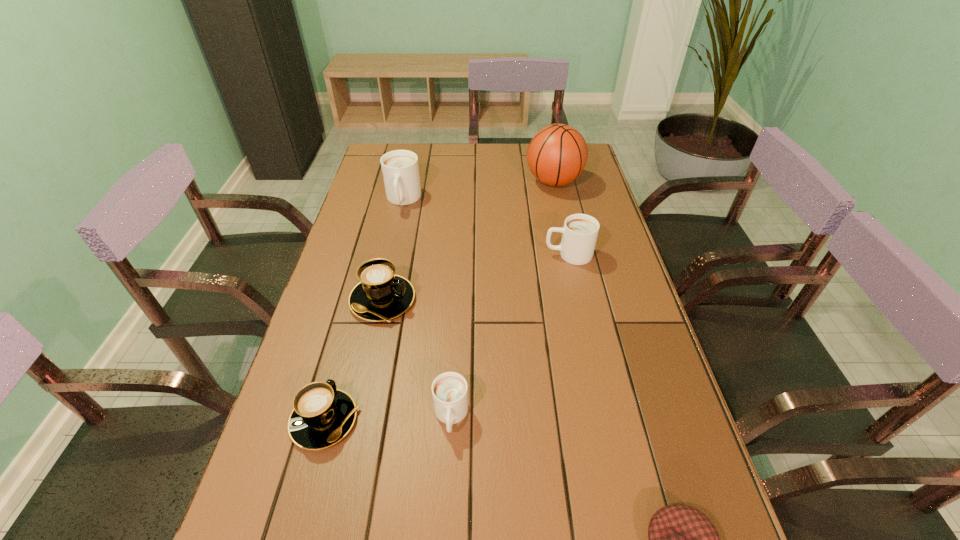
You are a GUI agent. You are given a task and a screenshot of the screen. Output one action in this format:
    pyautogui.click(x=<x>, y=<y>)
    Task: Click on the free space located on the front of the basketball
    
    Given the screenshot: What is the action you would take?
    pyautogui.click(x=562, y=219)

This screenshot has height=540, width=960. I want to click on vacant space located on the side with the handle of the tallest cappuccino, so click(395, 241).

Where is `vacant region located on the side with the handle of the rightmost white cappuccino`? This screenshot has width=960, height=540. vacant region located on the side with the handle of the rightmost white cappuccino is located at coordinates (437, 254).

The height and width of the screenshot is (540, 960). In order to click on free space located on the side with the handle of the rightmost white cappuccino in this screenshot , I will do `click(467, 254)`.

Find the location of a particular element. vacant space located on the side with the handle of the rightmost white cappuccino is located at coordinates (470, 254).

The height and width of the screenshot is (540, 960). I want to click on free space located on the front of the fourth nearest object, so pos(372,349).

Locate an element on the screen. Image resolution: width=960 pixels, height=540 pixels. blank space located on the side with the handle of the smallest white cappuccino is located at coordinates (447, 492).

Where is `vacant space positioned on the front of the nearer black cappuccino`? vacant space positioned on the front of the nearer black cappuccino is located at coordinates (293, 536).

Identify the location of object that is positioned at the far edge. The height and width of the screenshot is (540, 960). (557, 154).

The height and width of the screenshot is (540, 960). Find the location of `basketball that is at the right edge`. basketball that is at the right edge is located at coordinates (557, 154).